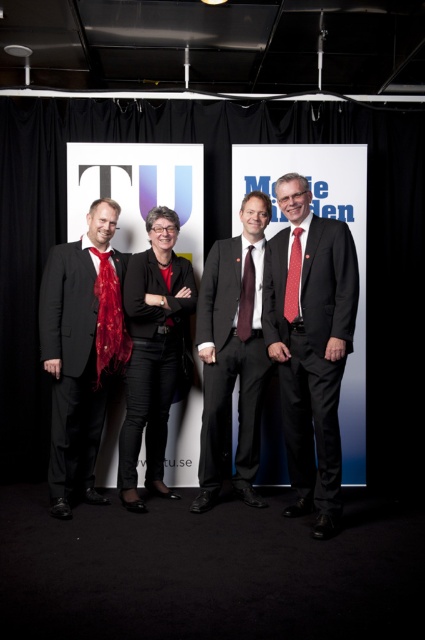
You are attending a formal event and see two people in the image. One is wearing a dark gray suit at center and the other has a shiny red scarf at left. Based on their positions, which person is standing closer to the left side of the image?

The shiny red scarf at left is positioned to the left of the dark gray suit at center, so the person with the shiny red scarf at left is closer to the left side of the image.

You are standing in front of the banners and want to read the text on the white paperboard at center. Considering your current position, can you comfortably read the text without moving closer?

The white paperboard at center is 12.66 feet away from viewer. Since this distance is within a typical comfortable reading distance for larger text, it is likely readable without moving closer, assuming the text size is standard for such a board.